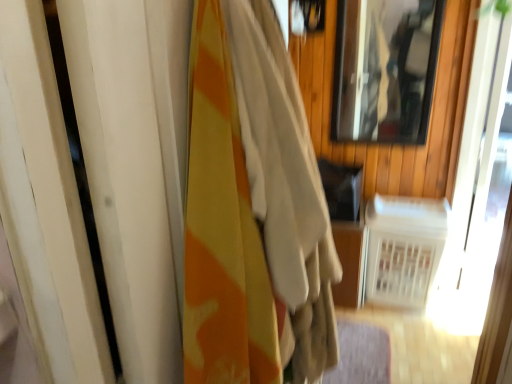
Question: From the image's perspective, is clear glass mirror at upper right under white plastic radiator at lower right?

Choices:
 (A) yes
 (B) no

Answer: (B)

Question: Does clear glass mirror at upper right have a greater height compared to white plastic radiator at lower right?

Choices:
 (A) no
 (B) yes

Answer: (B)

Question: Can you confirm if clear glass mirror at upper right is shorter than white plastic radiator at lower right?

Choices:
 (A) yes
 (B) no

Answer: (B)

Question: From the image's perspective, would you say clear glass mirror at upper right is positioned over white plastic radiator at lower right?

Choices:
 (A) yes
 (B) no

Answer: (A)

Question: Is clear glass mirror at upper right located outside white plastic radiator at lower right?

Choices:
 (A) no
 (B) yes

Answer: (B)

Question: Is clear glass mirror at upper right taller or shorter than white plastic radiator at lower right?

Choices:
 (A) tall
 (B) short

Answer: (A)

Question: Is clear glass mirror at upper right inside the boundaries of white plastic radiator at lower right, or outside?

Choices:
 (A) inside
 (B) outside

Answer: (B)

Question: Considering their positions, is clear glass mirror at upper right located in front of or behind white plastic radiator at lower right?

Choices:
 (A) front
 (B) behind

Answer: (A)

Question: From the image's perspective, is clear glass mirror at upper right above or below white plastic radiator at lower right?

Choices:
 (A) below
 (B) above

Answer: (B)

Question: In terms of size, does white plastic radiator at lower right appear bigger or smaller than camouflage fabric curtain at left?

Choices:
 (A) small
 (B) big

Answer: (A)

Question: In terms of height, does white plastic radiator at lower right look taller or shorter compared to camouflage fabric curtain at left?

Choices:
 (A) tall
 (B) short

Answer: (B)

Question: From the image's perspective, is white plastic radiator at lower right above or below camouflage fabric curtain at left?

Choices:
 (A) below
 (B) above

Answer: (A)

Question: Is white plastic radiator at lower right in front of or behind camouflage fabric curtain at left in the image?

Choices:
 (A) behind
 (B) front

Answer: (A)

Question: Looking at their shapes, would you say camouflage fabric curtain at left is wider or thinner than clear glass mirror at upper right?

Choices:
 (A) wide
 (B) thin

Answer: (A)

Question: Is camouflage fabric curtain at left taller or shorter than clear glass mirror at upper right?

Choices:
 (A) tall
 (B) short

Answer: (A)